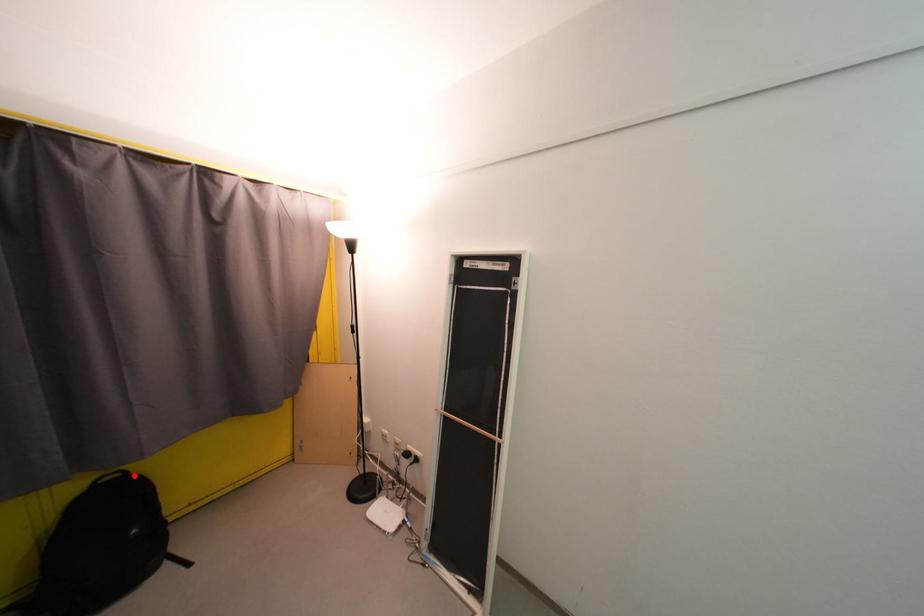
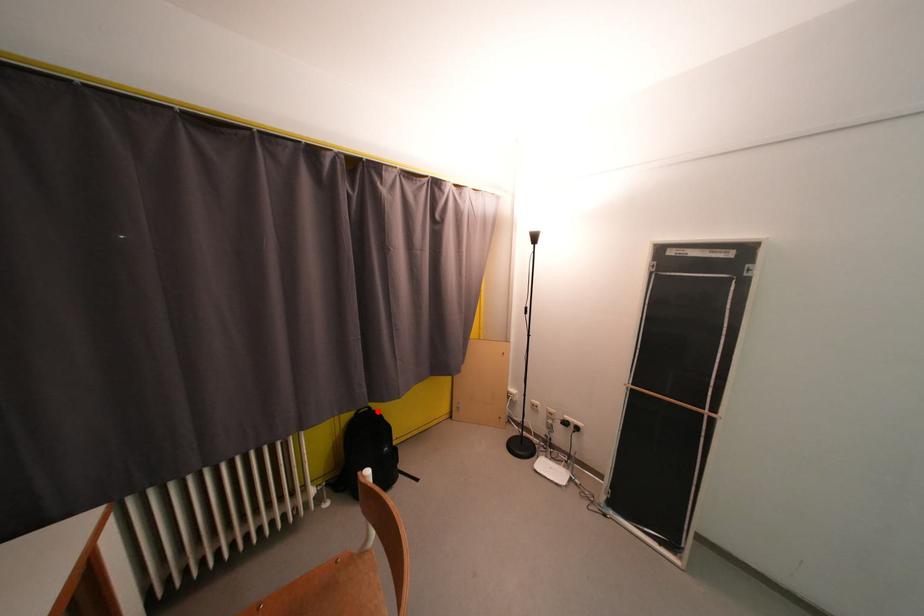
I am providing you with two images of the same scene from different viewpoints. A red point is marked on the first image and another point is marked on the second image. Are the points marked in image1 and image2 representing the same 3D position?

Yes